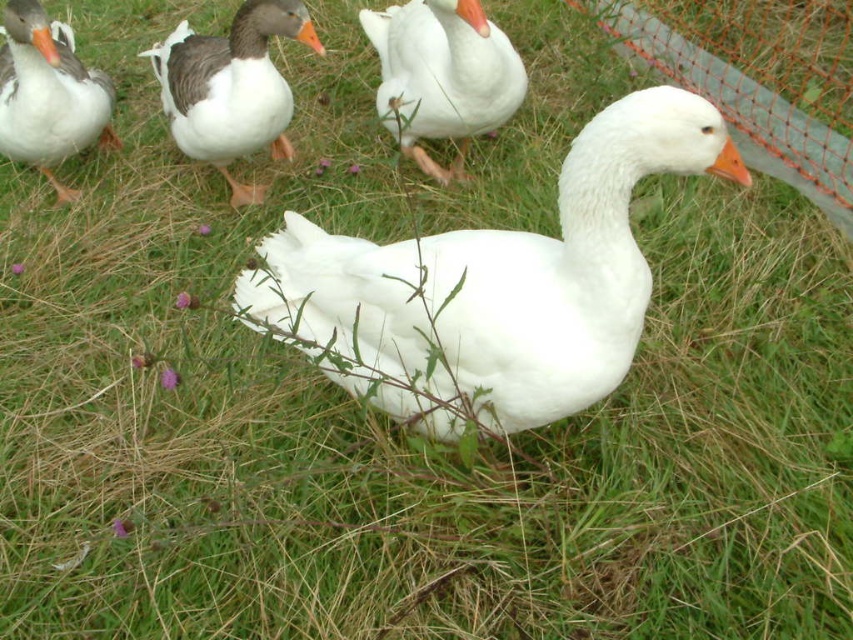
You are a birdwatcher observing the geese in the grassy area. You notice the white matte goose at upper center and the matte gray duck at upper left. Which of these two birds is shorter in height?

The white matte goose at upper center has a lesser height compared to the matte gray duck at upper left, so the white matte goose at upper center is shorter.

Based on the photo, you are standing in the grassy area with the geese and want to place a small treat between the two points marked as point [440,3] and point [35,52]. Which point should you aim for if you want the treat to be closer to you?

You should aim for point [440,3] because it is closer to the viewer than point [35,52].

You are a photographer trying to capture a photo of the white matte goose at center and the white matte goose at upper center. Which goose should you focus on first if you want to include both in your shot without moving the camera?

You should focus on the white matte goose at center first because it is located below the white matte goose at upper center, so adjusting the camera angle to include both would require framing from the lower to upper positions.